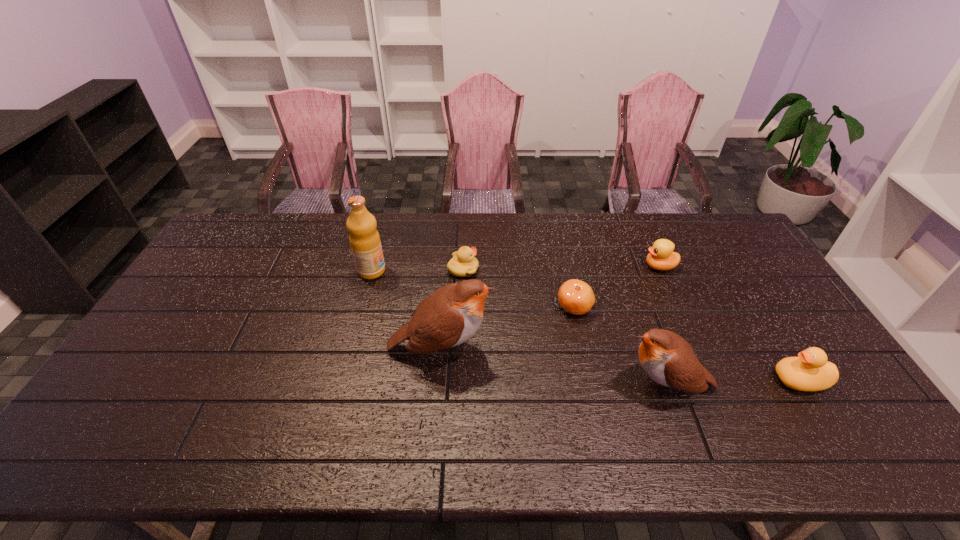
Please point a spot on the left to add another bird. Please provide its 2D coordinates. Your answer should be formatted as a tuple, i.e. [(x, y)], where the tuple contains the x and y coordinates of a point satisfying the conditions above.

[(246, 317)]